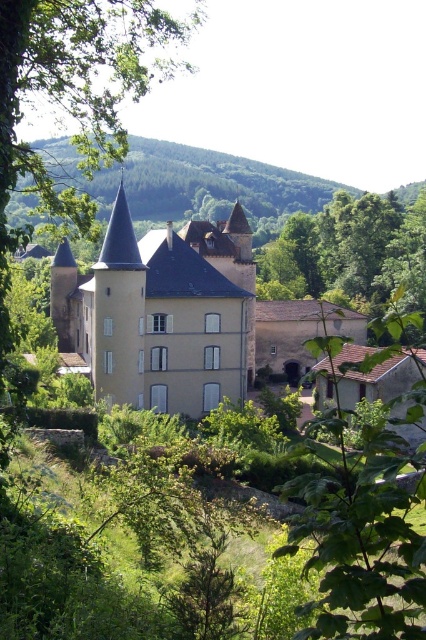
You are standing in the garden of the beige stone castle at center and want to take a photo of the green leafy tree at center. Since the castle is between you and the tree, will the tree be visible in your photo?

The beige stone castle at center is in front of the green leafy tree at center, so the tree will be partially or fully blocked by the castle in your photo.

You are standing in the lush green landscape and want to take a photo of the beige stone castle at center without any obstructions. However, there is a green leafy tree at center in the way. Based on their positions, can you determine if the tree is blocking the view of the castle?

The beige stone castle at center is positioned under the green leafy tree at center, so the tree is blocking the view of the castle.

You are an architect planning to build a model of the beige stone castle at center and the green leafy tree at center. If you want both models to be proportional to each other, which object should you make wider in your model?

The beige stone castle at center should be made wider in the model since its actual width is larger than the green leafy tree at center.